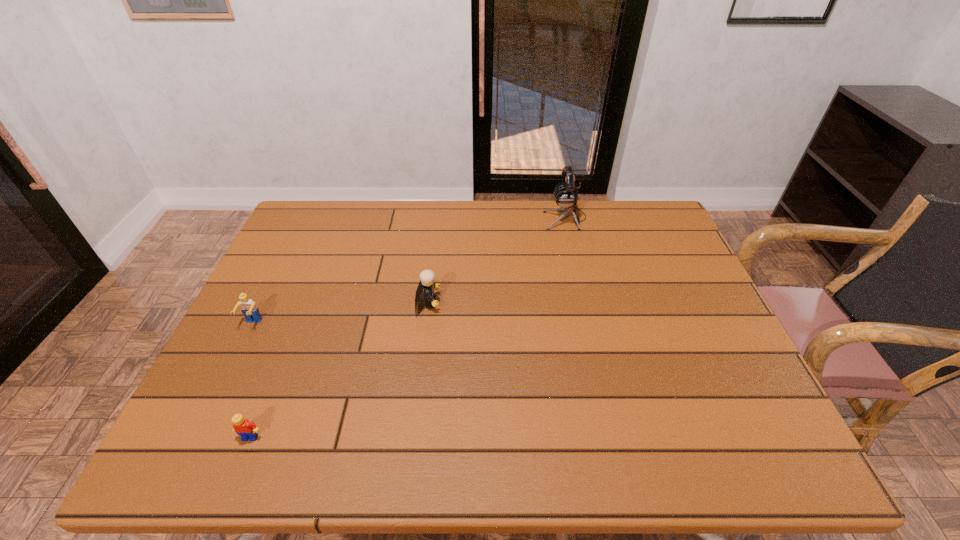
Where is `the farthest object`? This screenshot has height=540, width=960. the farthest object is located at coordinates (566, 195).

This screenshot has width=960, height=540. In order to click on earphone in this screenshot , I will do point(566,195).

The height and width of the screenshot is (540, 960). Identify the location of the rightmost Lego. (427, 277).

At what (x,y) coordinates should I click in order to perform the action: click on the third object from left to right. Please return your answer as a coordinate pair (x, y). Looking at the image, I should click on (427, 277).

Where is `the leftmost object`? the leftmost object is located at coordinates (248, 307).

This screenshot has width=960, height=540. What are the coordinates of `the second Lego from right to left` in the screenshot? It's located at (246, 429).

You are a GUI agent. You are given a task and a screenshot of the screen. Output one action in this format:
    pyautogui.click(x=<x>, y=<y>)
    Task: Click on the nearest Lego
    
    Given the screenshot: What is the action you would take?
    [246, 429]

Locate an element on the screen. The height and width of the screenshot is (540, 960). free location located 0.100m on the left of the farthest object is located at coordinates (515, 218).

You are a GUI agent. You are given a task and a screenshot of the screen. Output one action in this format:
    pyautogui.click(x=<x>, y=<y>)
    Task: Click on the free space located on the front-facing side of the third object from left to right
    The width and height of the screenshot is (960, 540).
    Given the screenshot: What is the action you would take?
    570,303

Where is `vacant space located 0.300m on the face of the leftmost object`? vacant space located 0.300m on the face of the leftmost object is located at coordinates (193, 444).